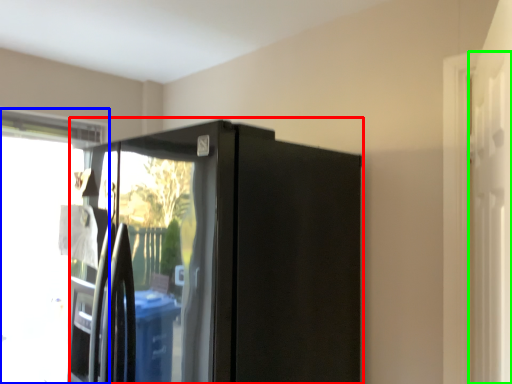
Question: Based on their relative distances, which object is farther from appliance (highlighted by a red box)? Choose from window (highlighted by a blue box) and screen door (highlighted by a green box).

Choices:
 (A) window
 (B) screen door

Answer: (A)